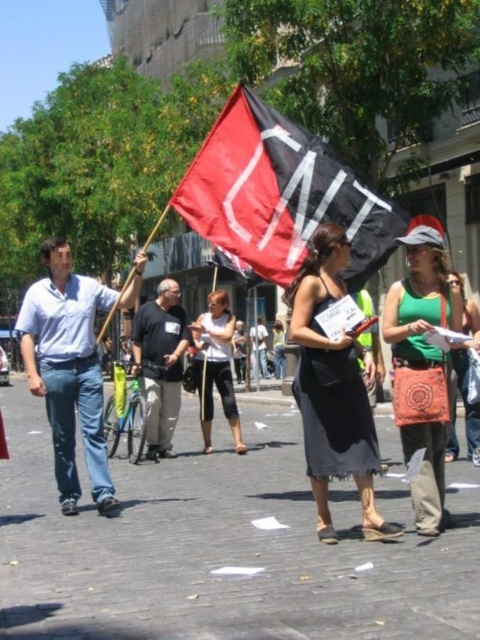
Does light blue shirt at center have a larger size compared to green fabric purse at right?

Correct, light blue shirt at center is larger in size than green fabric purse at right.

How much distance is there between light blue shirt at center and green fabric purse at right?

light blue shirt at center and green fabric purse at right are 9.79 feet apart.

Is point (140, 284) less distant than point (427, 259)?

No, (140, 284) is further to viewer.

Identify the location of light blue shirt at center. (71, 365).

Does point (319, 452) come behind point (189, 340)?

No, (319, 452) is in front of (189, 340).

Which is in front, point (312, 284) or point (156, 440)?

Point (312, 284) is in front.

Which is in front, point (355, 460) or point (178, 358)?

Point (355, 460) is in front.

This screenshot has height=640, width=480. Identify the location of black cotton skirt at center. (x=333, y=388).

Which is in front, point (55, 360) or point (167, 326)?

Point (55, 360) is more forward.

Describe the element at coordinates (71, 365) in the screenshot. I see `light blue shirt at center` at that location.

Which is in front, point (94, 285) or point (175, 362)?

Point (94, 285) is in front.

What are the coordinates of `light blue shirt at center` in the screenshot? It's located at point(71,365).